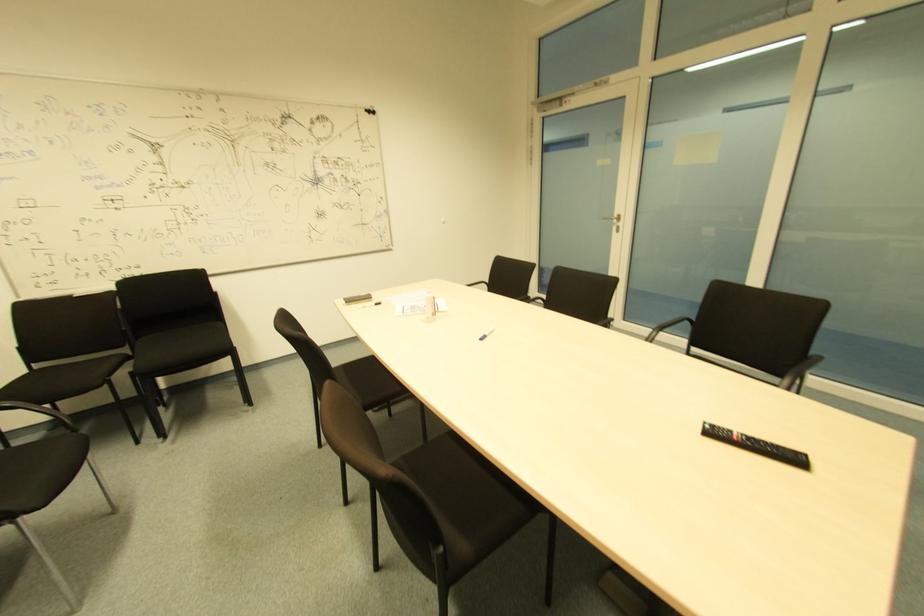
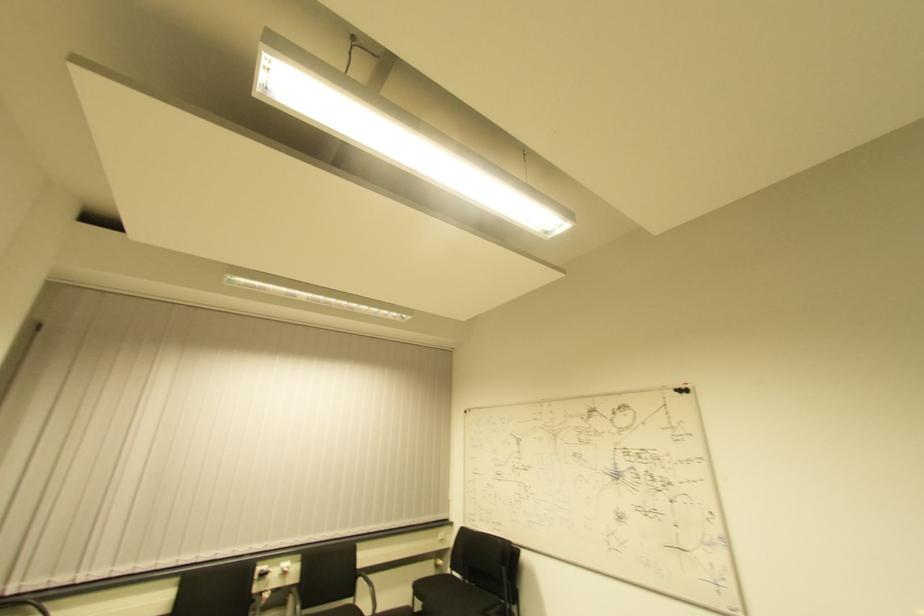
Locate, in the second image, the point that corresponds to pixel 34 370 in the first image.

(454, 576)